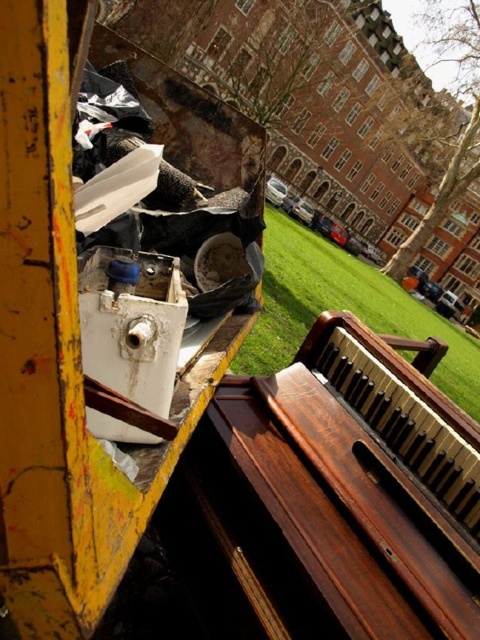
You are a gardener who needs to mow the green grass at center. However, there is a wooden polished piano at lower right blocking your path. Can you move the piano to access the grass?

The wooden polished piano at lower right is in front of green grass at center, so the piano is blocking the path to the grass. You need to move the piano to access the green grass at center.

You are a gardener who needs to mow the lawn. You see the wooden polished piano at lower right and the green grass at center. Which one is shorter in height?

The wooden polished piano at lower right is not as tall as the green grass at center, so the piano is shorter in height.